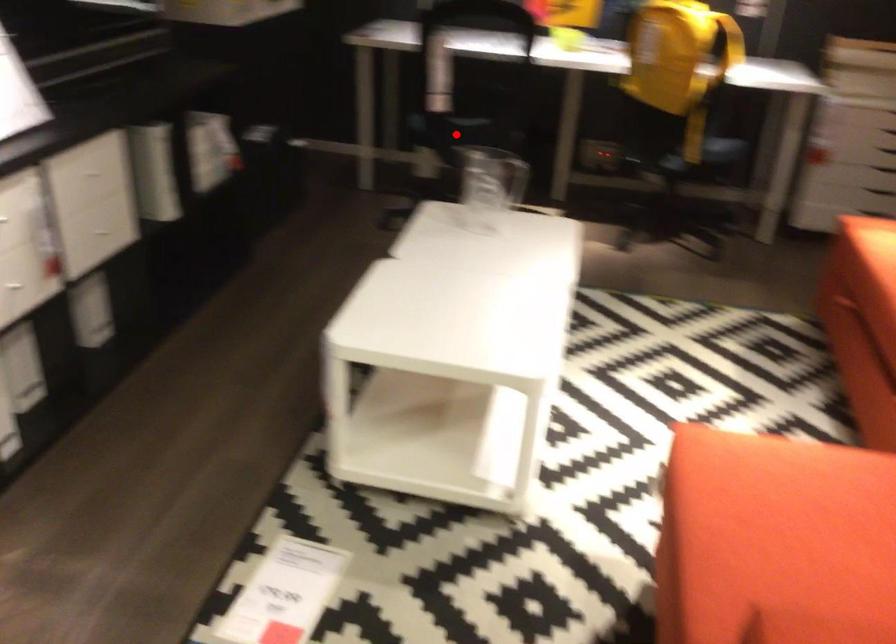
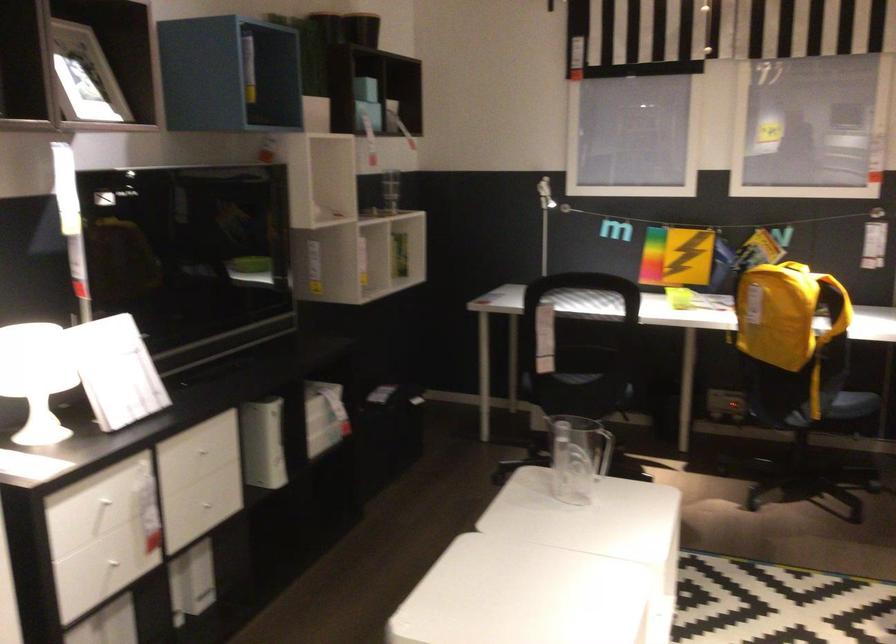
Locate, in the second image, the point that corresponds to the highlighted location in the first image.

(571, 393)